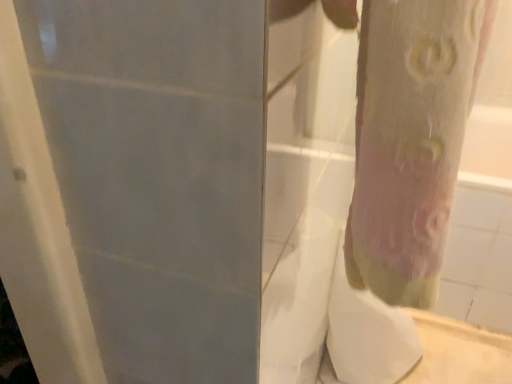
Question: Is pink fabric tree trunk at right aimed at white sheer fabric at lower right?

Choices:
 (A) yes
 (B) no

Answer: (B)

Question: From a real-world perspective, is pink fabric tree trunk at right positioned under white sheer fabric at lower right based on gravity?

Choices:
 (A) yes
 (B) no

Answer: (B)

Question: Can you confirm if pink fabric tree trunk at right is wider than white sheer fabric at lower right?

Choices:
 (A) no
 (B) yes

Answer: (A)

Question: Is pink fabric tree trunk at right positioned behind white sheer fabric at lower right?

Choices:
 (A) yes
 (B) no

Answer: (B)

Question: From the image's perspective, is pink fabric tree trunk at right beneath white sheer fabric at lower right?

Choices:
 (A) no
 (B) yes

Answer: (A)

Question: Considering the relative positions of pink fabric tree trunk at right and white sheer fabric at lower right in the image provided, is pink fabric tree trunk at right in front of white sheer fabric at lower right?

Choices:
 (A) no
 (B) yes

Answer: (B)

Question: Can you confirm if white sheer fabric at lower right is thinner than pink fabric tree trunk at right?

Choices:
 (A) no
 (B) yes

Answer: (A)

Question: Does white sheer fabric at lower right turn towards pink fabric tree trunk at right?

Choices:
 (A) no
 (B) yes

Answer: (A)

Question: Is white sheer fabric at lower right not inside pink fabric tree trunk at right?

Choices:
 (A) yes
 (B) no

Answer: (A)

Question: Does white sheer fabric at lower right touch pink fabric tree trunk at right?

Choices:
 (A) yes
 (B) no

Answer: (B)

Question: Is white sheer fabric at lower right behind pink fabric tree trunk at right?

Choices:
 (A) yes
 (B) no

Answer: (A)

Question: From a real-world perspective, is white sheer fabric at lower right over pink fabric tree trunk at right?

Choices:
 (A) no
 (B) yes

Answer: (A)

Question: Looking at the image, does white sheer fabric at lower right seem bigger or smaller compared to pink fabric tree trunk at right?

Choices:
 (A) small
 (B) big

Answer: (B)